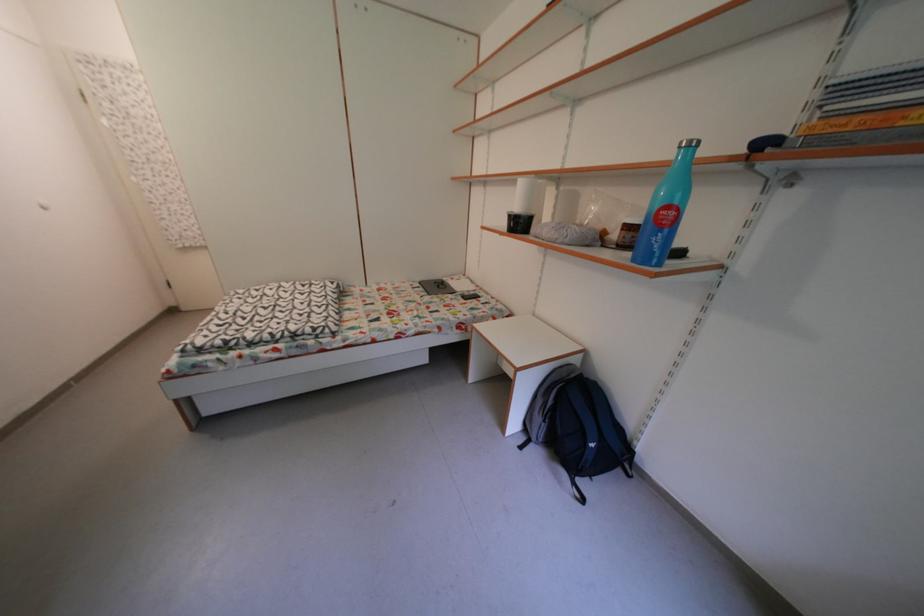
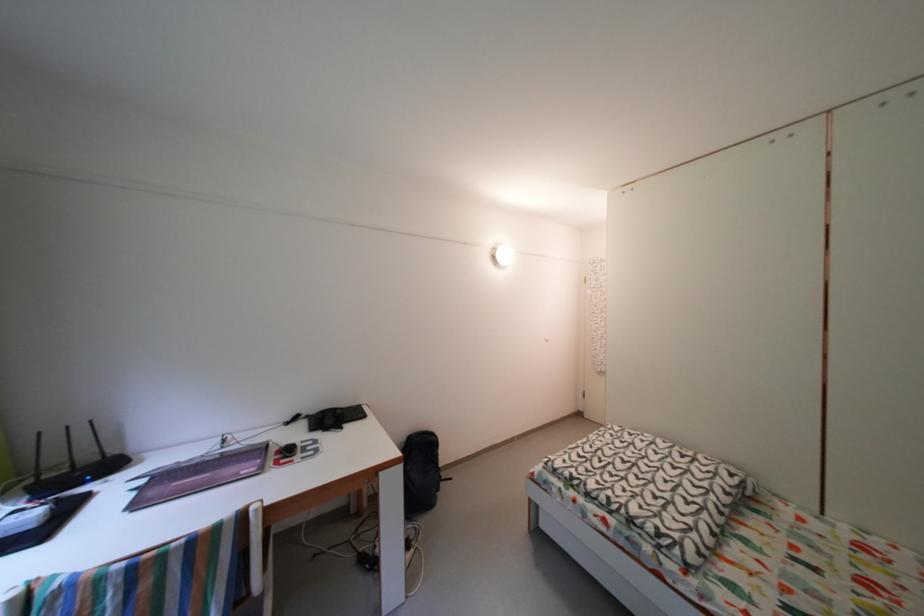
Question: The camera is either moving clockwise (left) or counter-clockwise (right) around the object. The first image is from the beginning of the video and the second image is from the end. Is the camera moving left or right when shooting the video?

Choices:
 (A) Left
 (B) Right

Answer: (B)